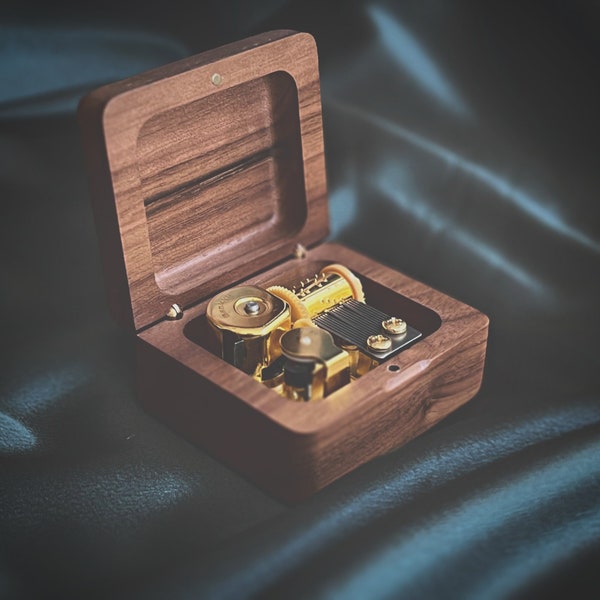
Identify the location of left hinge. (176, 305).